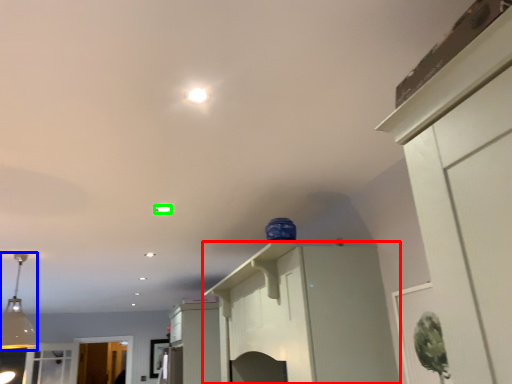
Question: Which is nearer to the cabinetry (highlighted by a red box)? light fixture (highlighted by a blue box) or light (highlighted by a green box).

Choices:
 (A) light fixture
 (B) light

Answer: (B)